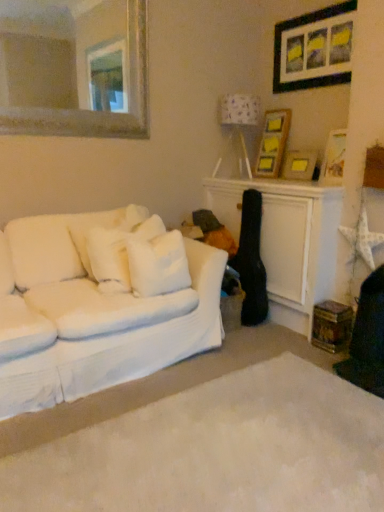
Question: From a real-world perspective, does white soft pillow at left, acting as the first pillow starting from the left, sit lower than white fabric lampshade at upper right?

Choices:
 (A) no
 (B) yes

Answer: (B)

Question: Is white soft pillow at left, acting as the first pillow starting from the left, closer to the viewer compared to white fabric lampshade at upper right?

Choices:
 (A) yes
 (B) no

Answer: (A)

Question: Does white soft pillow at left, acting as the first pillow starting from the left, appear on the right side of white fabric lampshade at upper right?

Choices:
 (A) no
 (B) yes

Answer: (A)

Question: Could white fabric lampshade at upper right be considered to be inside white soft pillow at left, marked as the second pillow in a right-to-left arrangement?

Choices:
 (A) no
 (B) yes

Answer: (A)

Question: Can you confirm if white soft pillow at left, acting as the first pillow starting from the left, is taller than white fabric lampshade at upper right?

Choices:
 (A) yes
 (B) no

Answer: (B)

Question: Relative to white soft pillow at center, the second pillow positioned from the left, is wooden picture frame at upper right, which appears as the 2th picture frame when viewed from the top, in front or behind?

Choices:
 (A) behind
 (B) front

Answer: (A)

Question: Is point (263, 166) closer or farther from the camera than point (147, 271)?

Choices:
 (A) closer
 (B) farther

Answer: (B)

Question: Is wooden picture frame at upper right, which is the 3th picture frame in bottom-to-top order, situated inside white soft pillow at center, the first pillow when ordered from right to left, or outside?

Choices:
 (A) inside
 (B) outside

Answer: (B)

Question: Considering the positions of wooden picture frame at upper right, which appears as the 2th picture frame when viewed from the top, and white soft pillow at center, the first pillow when ordered from right to left, in the image, is wooden picture frame at upper right, which appears as the 2th picture frame when viewed from the top, taller or shorter than white soft pillow at center, the first pillow when ordered from right to left,?

Choices:
 (A) tall
 (B) short

Answer: (A)

Question: Is point (33, 130) closer or farther from the camera than point (367, 307)?

Choices:
 (A) farther
 (B) closer

Answer: (A)

Question: Is gold-framed mirror at upper left situated inside wooden swivel chair at lower right or outside?

Choices:
 (A) outside
 (B) inside

Answer: (A)

Question: In terms of width, does gold-framed mirror at upper left look wider or thinner when compared to wooden swivel chair at lower right?

Choices:
 (A) thin
 (B) wide

Answer: (A)

Question: Considering the relative positions of gold-framed mirror at upper left and wooden swivel chair at lower right in the image provided, is gold-framed mirror at upper left to the left or to the right of wooden swivel chair at lower right?

Choices:
 (A) left
 (B) right

Answer: (A)

Question: Would you say white soft pillow at center, the first pillow when ordered from right to left, is to the left or to the right of white soft carpet at lower center in the picture?

Choices:
 (A) right
 (B) left

Answer: (B)

Question: Is white soft pillow at center, the second pillow positioned from the left, in front of or behind white soft carpet at lower center in the image?

Choices:
 (A) front
 (B) behind

Answer: (B)